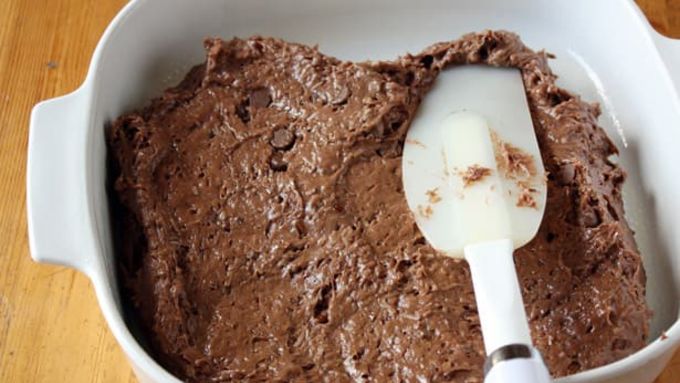
I want to click on handle, so click(506, 368).